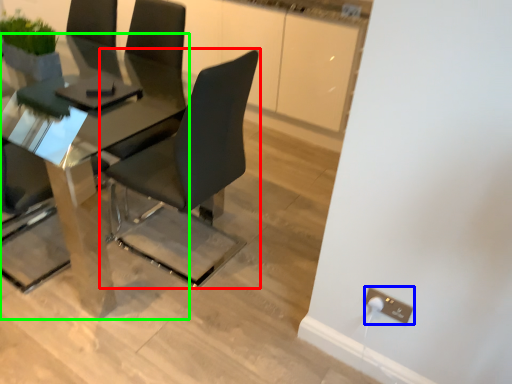
Question: Considering the real-world distances, which object is farthest from chair (highlighted by a red box)? electric outlet (highlighted by a blue box) or table (highlighted by a green box)?

Choices:
 (A) electric outlet
 (B) table

Answer: (A)